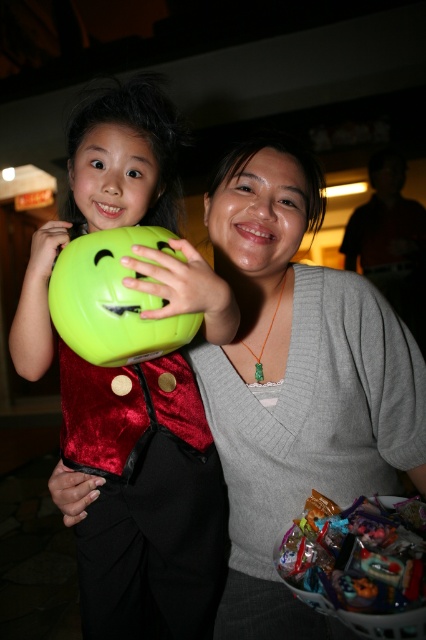
Which of these two, matte gray sweater at center or green matte balloon at center, stands taller?

With more height is matte gray sweater at center.

Is point (347, 403) positioned behind point (149, 260)?

Yes, it is behind point (149, 260).

I want to click on matte gray sweater at center, so click(296, 381).

Find the location of a particular element. This screenshot has height=640, width=426. matte gray sweater at center is located at coordinates (296, 381).

Who is more forward, (235, 438) or (178, 588)?

Point (235, 438) is in front.

Is matte gray sweater at center further to camera compared to matte green helmet at center?

That is True.

Is point (373, 481) closer to camera compared to point (149, 428)?

Yes.

The height and width of the screenshot is (640, 426). I want to click on matte gray sweater at center, so click(x=296, y=381).

Is matte green helmet at center further to the viewer compared to green matte balloon at center?

No.

Who is lower down, matte green helmet at center or green matte balloon at center?

Positioned lower is matte green helmet at center.

Describe the element at coordinates (144, 499) in the screenshot. The image size is (426, 640). I see `matte green helmet at center` at that location.

This screenshot has width=426, height=640. I want to click on matte green helmet at center, so click(144, 499).